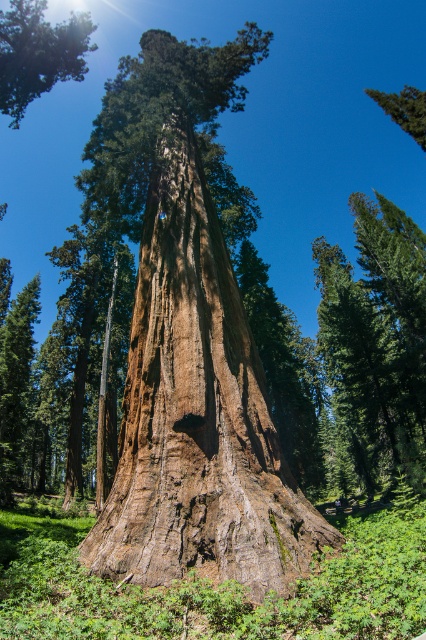
You are standing in front of the towering redwood tree and want to take a photo of the brown rough bark tree trunk at center. Where should you position yourself to capture the trunk at the coordinates mentioned?

The brown rough bark tree trunk at center is located at point (196, 412), so you should position yourself directly in front of the tree trunk at those coordinates to capture it in your photo.

You are a hiker standing at the base of the brown rough bark tree trunk at center and want to take a photo of the smooth brown tree trunk at upper left. Which direction should you face to capture it in your camera?

The brown rough bark tree trunk at center is positioned on the right side of smooth brown tree trunk at upper left, so you should face to the left to capture the smooth brown tree trunk at upper left in your photo.

You are a bird looking for a place to perch. You see the point at coordinates (196, 412) in the image. Based on the scene description, what is the surface like at that point?

The point at coordinates (196, 412) is on the brown rough bark tree trunk at center, which has a rugged and textured surface with deep grooves, making it suitable for perching.